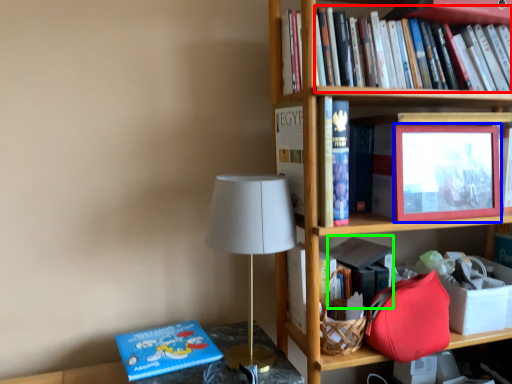
Question: Based on their relative distances, which object is farther from book (highlighted by a red box)? Choose from picture frame (highlighted by a blue box) and paperback book (highlighted by a green box).

Choices:
 (A) picture frame
 (B) paperback book

Answer: (B)